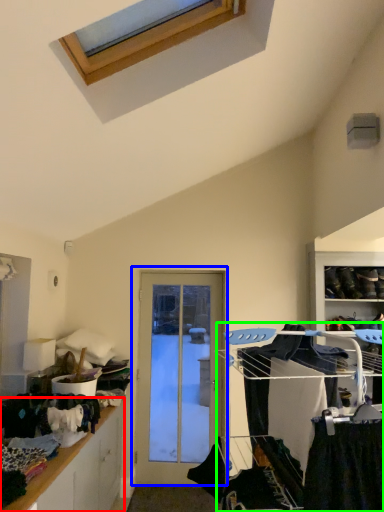
Question: Based on their relative distances, which object is nearer to cabinetry (highlighted by a red box)? Choose from door (highlighted by a blue box) and bunk bed (highlighted by a green box).

Choices:
 (A) door
 (B) bunk bed

Answer: (A)